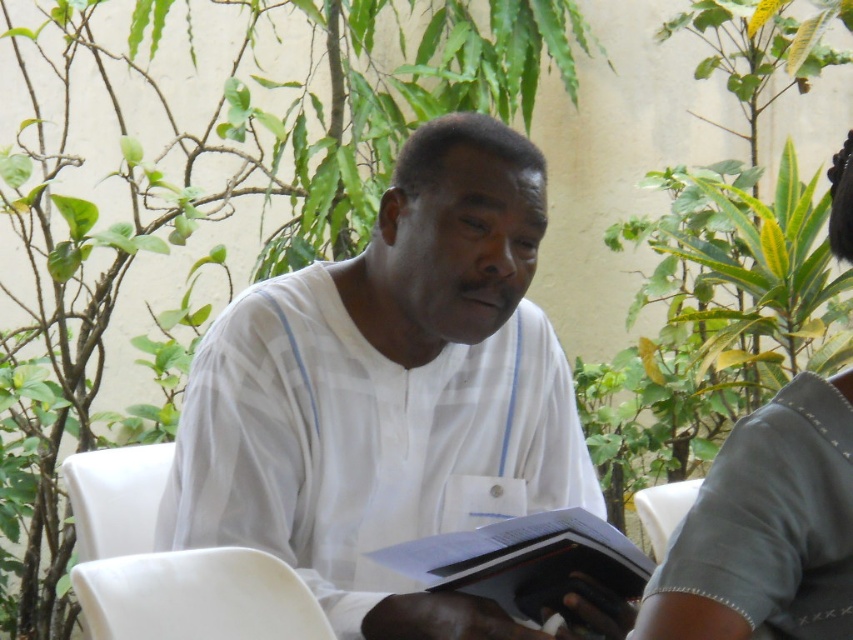
Question: Is gray fabric shirt at upper right positioned before hardcover book at center?

Choices:
 (A) yes
 (B) no

Answer: (A)

Question: Which point is farther from the camera taking this photo?

Choices:
 (A) (666, 506)
 (B) (457, 184)
 (C) (80, 570)

Answer: (A)

Question: Among these objects, which one is farthest from the camera?

Choices:
 (A) gray fabric shirt at upper right
 (B) white plastic chair at left

Answer: (B)

Question: Which point is farther to the camera?

Choices:
 (A) (187, 618)
 (B) (532, 595)

Answer: (B)

Question: Does hardcover book at center have a larger size compared to white plastic chair at lower right?

Choices:
 (A) yes
 (B) no

Answer: (A)

Question: Can you confirm if hardcover book at center is bigger than white plastic chair at lower right?

Choices:
 (A) yes
 (B) no

Answer: (A)